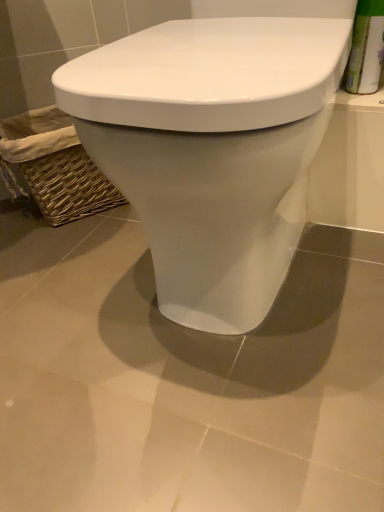
Find the location of a particular element. Image resolution: width=384 pixels, height=512 pixels. blank area to the left of white glossy toilet at center is located at coordinates (64, 297).